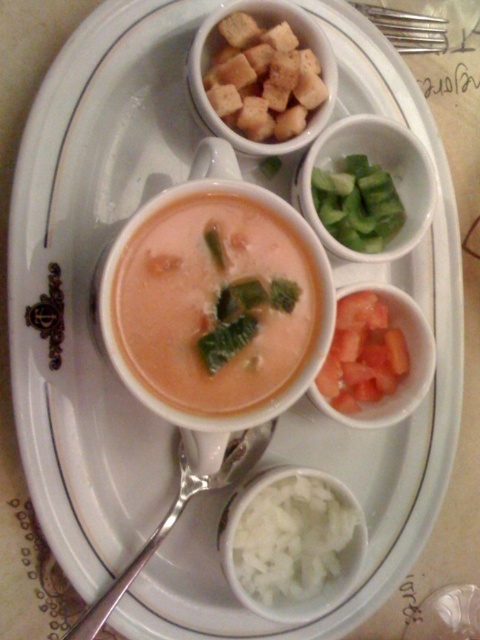
Question: Among these objects, which one is farthest from the camera?

Choices:
 (A) smooth creamy tomato soup at center
 (B) green cucumber at upper right
 (C) brown croutons at upper center

Answer: (B)

Question: Which point is closer to the camera?

Choices:
 (A) smooth creamy tomato soup at center
 (B) tomato-red glass bowl at upper right
 (C) white fluffy rice at lower center

Answer: (A)

Question: Which object is the farthest from the greencutcucumber at right?

Choices:
 (A) green cucumber at upper right
 (B) brown croutons at upper center
 (C) satin silver spoon at lower left

Answer: (C)

Question: Does green cucumber at upper right come in front of satin silver spoon at lower left?

Choices:
 (A) yes
 (B) no

Answer: (B)

Question: Is brown croutons at upper center smaller than tomato-red glass bowl at upper right?

Choices:
 (A) yes
 (B) no

Answer: (A)

Question: Is white fluffy rice at lower center below greencutcucumber at right?

Choices:
 (A) no
 (B) yes

Answer: (B)